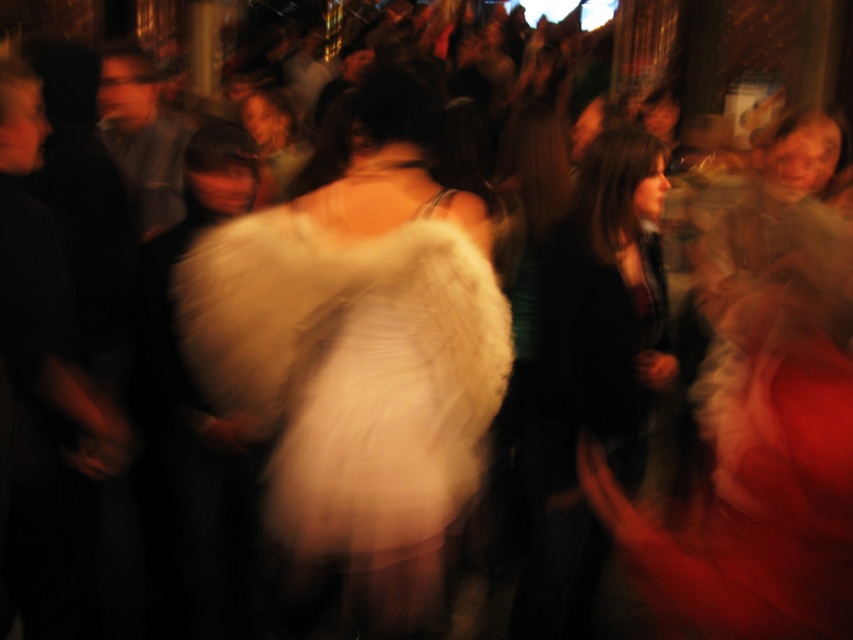
In the scene shown: Who is positioned more to the left, white fluffy dress at center or dark green fabric jacket at center?

white fluffy dress at center

Can you confirm if white fluffy dress at center is positioned below dark green fabric jacket at center?

Incorrect, white fluffy dress at center is not positioned below dark green fabric jacket at center.

Is point (422, 211) positioned in front of point (583, 384)?

Yes, it is.

The image size is (853, 640). What are the coordinates of `white fluffy dress at center` in the screenshot? It's located at (358, 353).